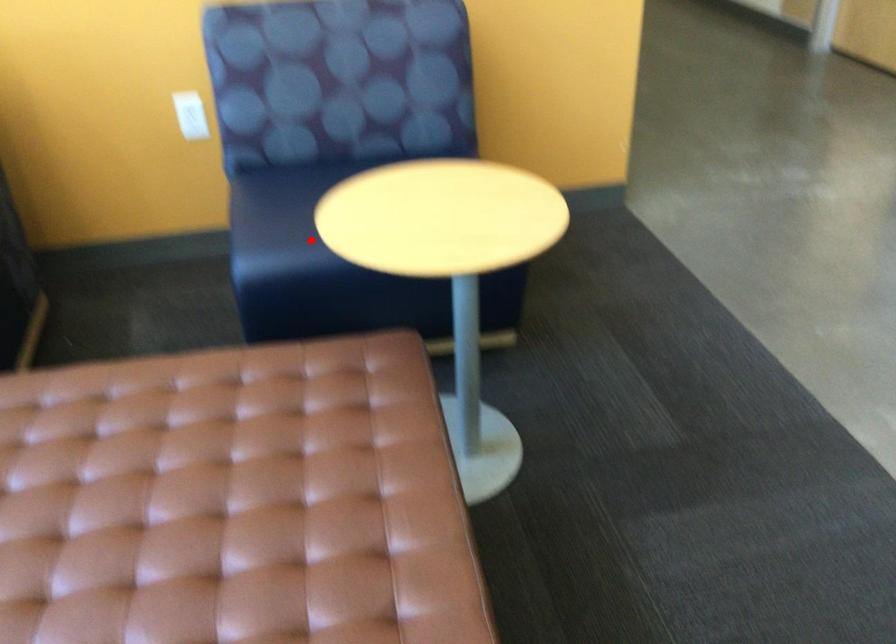
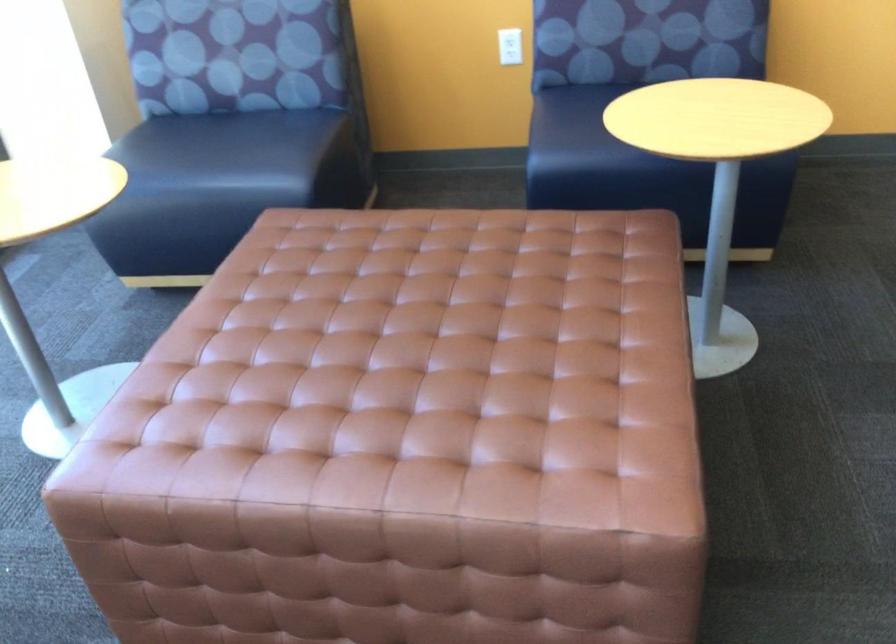
Find the pixel in the second image that matches the highlighted location in the first image.

(593, 146)